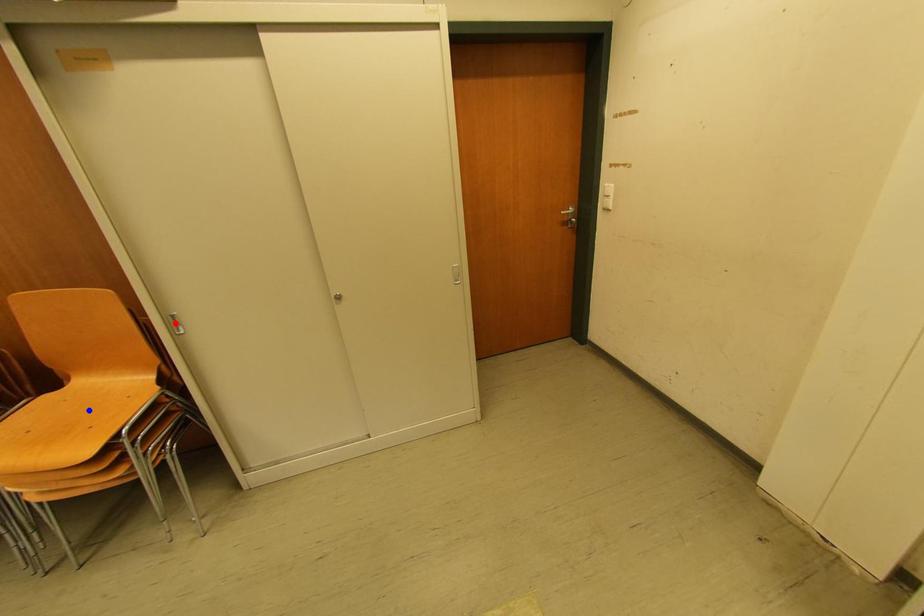
Question: Which of the two points in the image is closer to the camera?

Choices:
 (A) Blue point is closer.
 (B) Red point is closer.

Answer: (A)